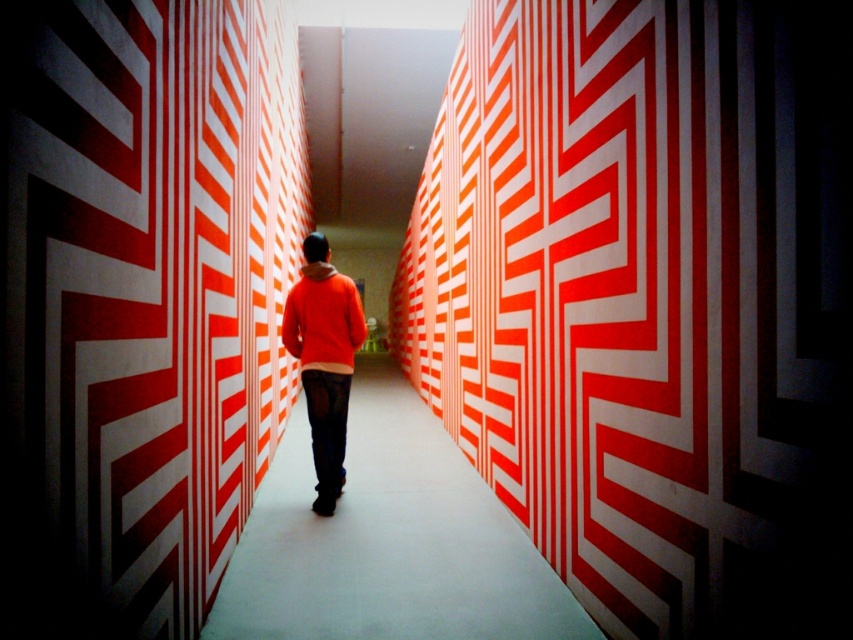
You are standing at the entrance of the corridor and see both the orange matte sweater at center and the orange fleece sweatshirt at center. Which one is closer to you?

The orange matte sweater at center is closer to you because it is positioned further to the viewer than the orange fleece sweatshirt at center.

You are standing in the corridor and notice both the matte orange wall at center and the orange matte sweater at center. Which object appears larger in size?

The orange matte sweater at center appears larger than the matte orange wall at center.

Looking at this image, you are standing in the corridor and see the matte orange wall at center and the orange fleece sweatshirt at center. Which one is closer to you?

The matte orange wall at center is closer to you because it is in front of the orange fleece sweatshirt at center.